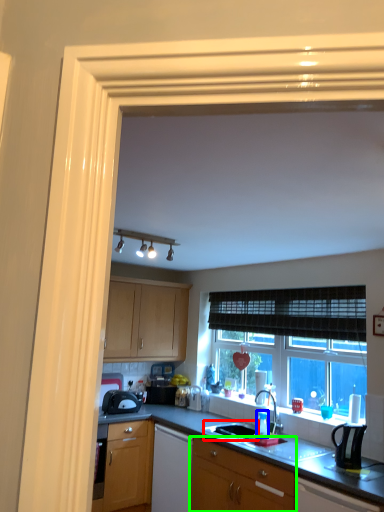
Question: Which is farther away from sink (highlighted by a red box)? bottle (highlighted by a blue box) or cabinetry (highlighted by a green box)?

Choices:
 (A) bottle
 (B) cabinetry

Answer: (B)